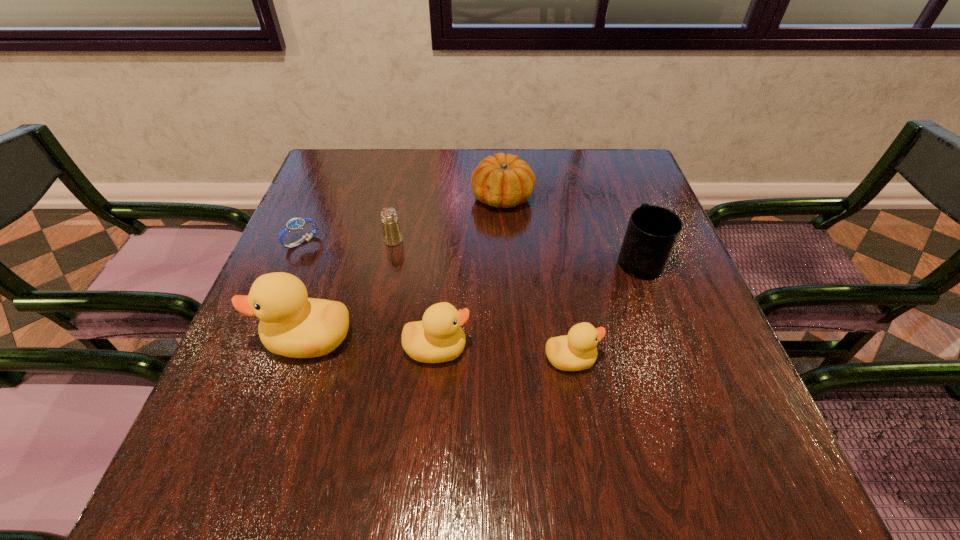
Find the location of a particular element. This screenshot has width=960, height=540. free point that keeps the ducklings evenly spaced on the right is located at coordinates (710, 370).